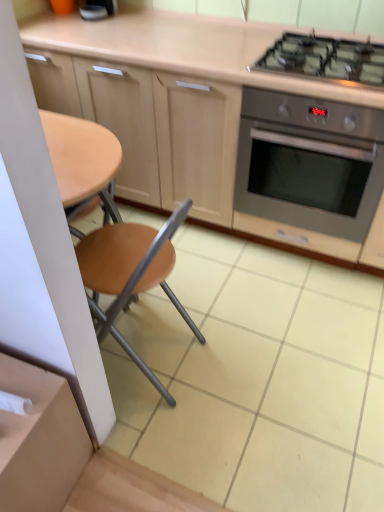
Question: Does matte wood cabinetry at upper center lie behind black glass gas stove at upper right?

Choices:
 (A) yes
 (B) no

Answer: (B)

Question: Does matte wood cabinetry at upper center have a larger size compared to black glass gas stove at upper right?

Choices:
 (A) no
 (B) yes

Answer: (B)

Question: Is black glass gas stove at upper right a part of matte wood cabinetry at upper center?

Choices:
 (A) no
 (B) yes

Answer: (B)

Question: Could you tell me if matte wood cabinetry at upper center is turned towards black glass gas stove at upper right?

Choices:
 (A) yes
 (B) no

Answer: (B)

Question: Is the depth of matte wood cabinetry at upper center less than that of black glass gas stove at upper right?

Choices:
 (A) no
 (B) yes

Answer: (B)

Question: Considering the relative positions of black glass gas stove at upper right and matte wood cabinetry at upper center in the image provided, is black glass gas stove at upper right to the left or to the right of matte wood cabinetry at upper center?

Choices:
 (A) left
 (B) right

Answer: (B)

Question: Considering the positions of point (360, 61) and point (210, 196), is point (360, 61) closer or farther from the camera than point (210, 196)?

Choices:
 (A) farther
 (B) closer

Answer: (B)

Question: Would you say black glass gas stove at upper right is inside or outside matte wood cabinetry at upper center?

Choices:
 (A) outside
 (B) inside

Answer: (B)

Question: From the image's perspective, is black glass gas stove at upper right positioned above or below matte wood cabinetry at upper center?

Choices:
 (A) above
 (B) below

Answer: (A)

Question: Is wooden seat at center wider or thinner than black glass gas stove at upper right?

Choices:
 (A) thin
 (B) wide

Answer: (A)

Question: Is wooden seat at center inside the boundaries of black glass gas stove at upper right, or outside?

Choices:
 (A) outside
 (B) inside

Answer: (A)

Question: In the image, is wooden seat at center on the left side or the right side of black glass gas stove at upper right?

Choices:
 (A) right
 (B) left

Answer: (B)

Question: Is wooden seat at center taller or shorter than black glass gas stove at upper right?

Choices:
 (A) tall
 (B) short

Answer: (A)

Question: Is stainless steel oven at right inside the boundaries of black glass gas stove at upper right, or outside?

Choices:
 (A) inside
 (B) outside

Answer: (B)

Question: Is point (241, 168) positioned closer to the camera than point (367, 69)?

Choices:
 (A) farther
 (B) closer

Answer: (A)